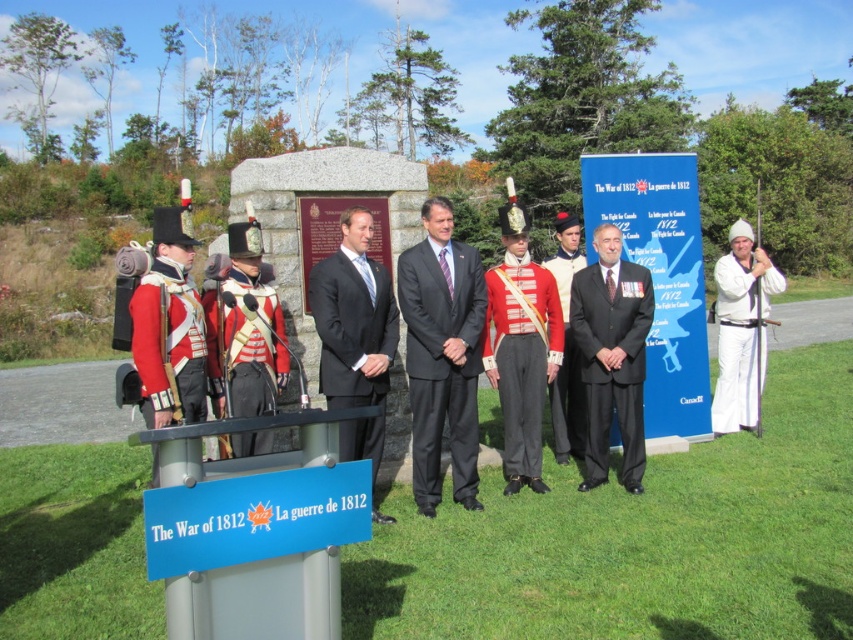
You are attending the commemoration event and want to take a photo of both the white matte suit at center and the red wool uniform at center. Which one should you focus on first to ensure both are in the frame?

You should focus on the white matte suit at center first since it is closer to you than the red wool uniform at center, ensuring both are in the frame by adjusting the camera angle accordingly.

You are a photographer at the event and need to capture a photo of both the black suit at center and the white matte suit at center. Which suit should you focus on first to ensure the taller one is properly framed?

The black suit at center is taller than the white matte suit at center, so you should focus on the black suit at center first to ensure proper framing.